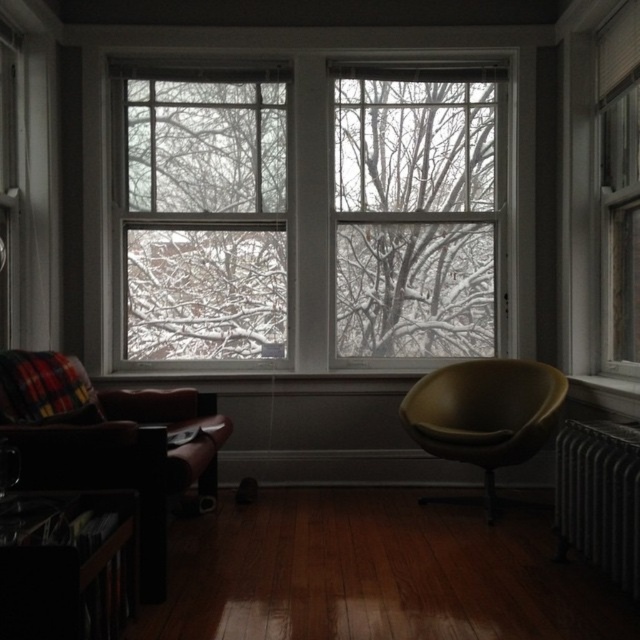
Question: Which object is the closest to the wooden bookshelf at lower left?

Choices:
 (A) clear glass window at upper right
 (B) leather armchair at left
 (C) silver metallic radiator at lower right

Answer: (B)

Question: Which object is farther from the camera taking this photo?

Choices:
 (A) leather-like chair at right
 (B) wooden bookshelf at lower left
 (C) leather armchair at left

Answer: (A)

Question: Which object is positioned closest to the wooden bookshelf at lower left?

Choices:
 (A) leather armchair at left
 (B) leather-like chair at right
 (C) silver metallic radiator at lower right

Answer: (A)

Question: Is leather armchair at left thinner than wooden bookshelf at lower left?

Choices:
 (A) yes
 (B) no

Answer: (B)

Question: Can you confirm if clear glass window at center is bigger than wooden bookshelf at lower left?

Choices:
 (A) no
 (B) yes

Answer: (B)

Question: Does wooden bookshelf at lower left have a lesser width compared to leather-like chair at right?

Choices:
 (A) no
 (B) yes

Answer: (B)